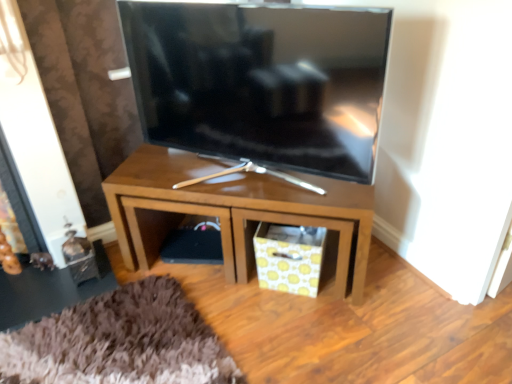
Question: From the image's perspective, is satin black tv at center on top of yellow patterned paper at lower center?

Choices:
 (A) no
 (B) yes

Answer: (B)

Question: From a real-world perspective, is satin black tv at center positioned under yellow patterned paper at lower center based on gravity?

Choices:
 (A) no
 (B) yes

Answer: (A)

Question: From a real-world perspective, does satin black tv at center stand above yellow patterned paper at lower center?

Choices:
 (A) yes
 (B) no

Answer: (A)

Question: Can you confirm if satin black tv at center is positioned to the right of yellow patterned paper at lower center?

Choices:
 (A) no
 (B) yes

Answer: (A)

Question: Does satin black tv at center turn towards yellow patterned paper at lower center?

Choices:
 (A) yes
 (B) no

Answer: (B)

Question: Can you confirm if satin black tv at center is thinner than yellow patterned paper at lower center?

Choices:
 (A) yes
 (B) no

Answer: (B)

Question: Considering the relative sizes of shiny metallic side table at lower left and yellow patterned paper at lower center in the image provided, is shiny metallic side table at lower left thinner than yellow patterned paper at lower center?

Choices:
 (A) no
 (B) yes

Answer: (A)

Question: Considering the relative sizes of shiny metallic side table at lower left and yellow patterned paper at lower center in the image provided, is shiny metallic side table at lower left wider than yellow patterned paper at lower center?

Choices:
 (A) no
 (B) yes

Answer: (B)

Question: Can you confirm if shiny metallic side table at lower left is shorter than yellow patterned paper at lower center?

Choices:
 (A) yes
 (B) no

Answer: (A)

Question: Is shiny metallic side table at lower left to the left of yellow patterned paper at lower center from the viewer's perspective?

Choices:
 (A) yes
 (B) no

Answer: (A)

Question: From a real-world perspective, is shiny metallic side table at lower left on top of yellow patterned paper at lower center?

Choices:
 (A) no
 (B) yes

Answer: (A)

Question: Considering the relative positions of shiny metallic side table at lower left and yellow patterned paper at lower center in the image provided, is shiny metallic side table at lower left behind yellow patterned paper at lower center?

Choices:
 (A) no
 (B) yes

Answer: (B)

Question: From the image's perspective, does wooden tv stand at center appear lower than satin black tv at center?

Choices:
 (A) no
 (B) yes

Answer: (B)